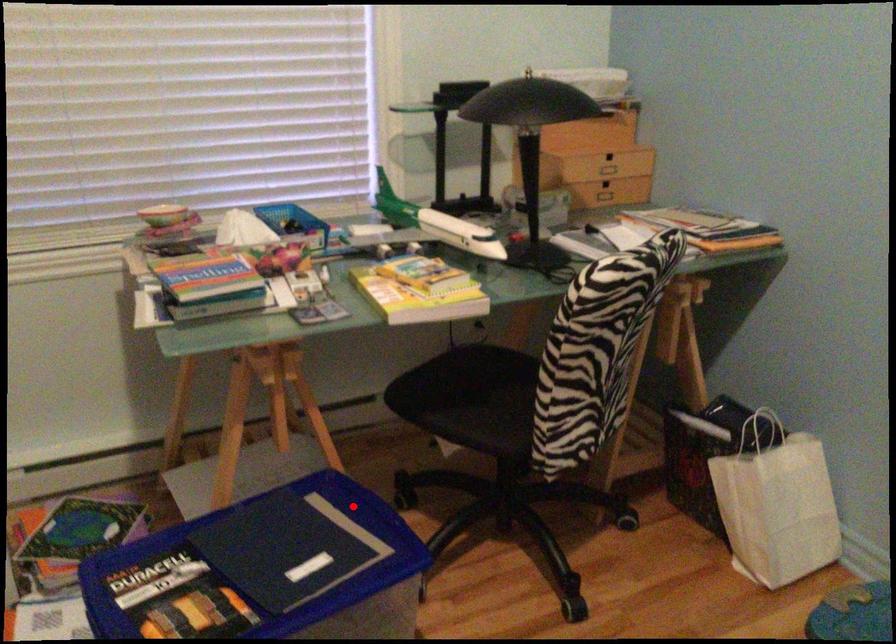
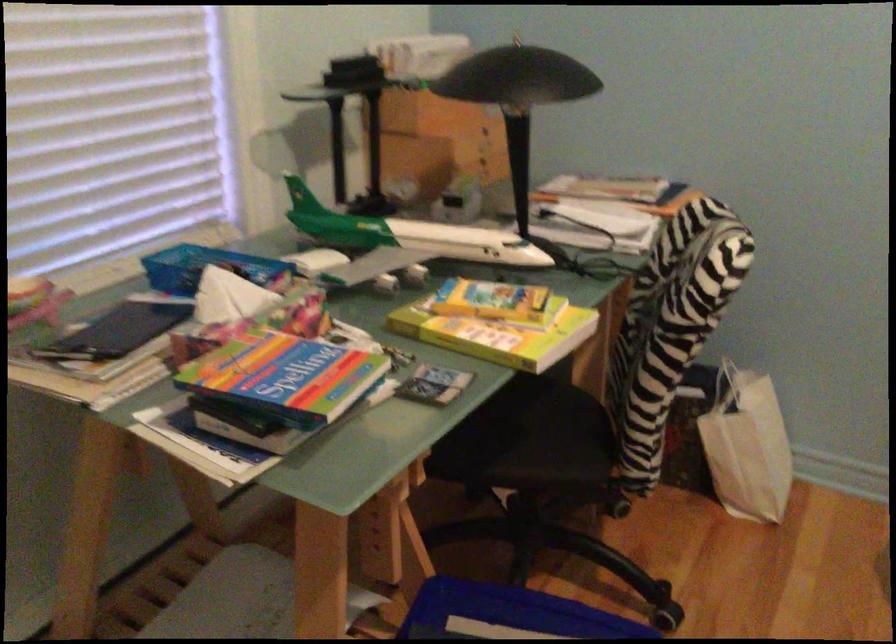
In the second image, find the point that corresponds to the highlighted location in the first image.

(507, 614)